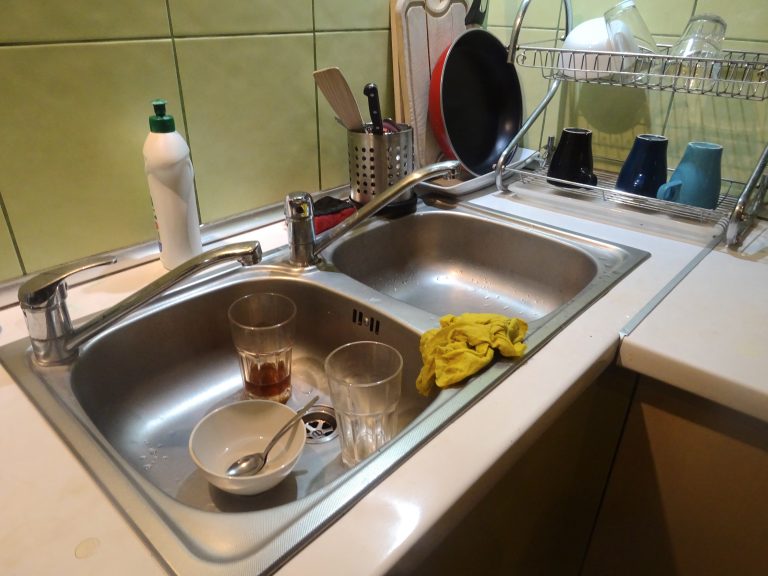
Find the location of `countertop`. countertop is located at coordinates (439, 488), (696, 329).